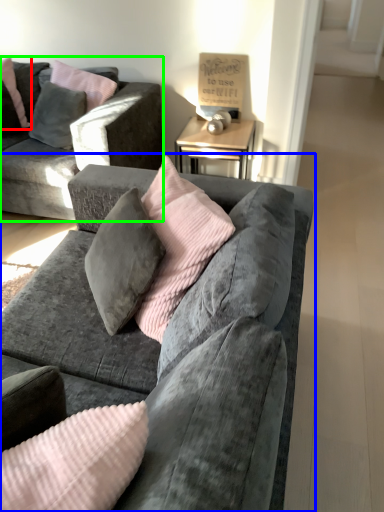
Question: Which object is the closest to the pillow (highlighted by a red box)? Choose among these: studio couch (highlighted by a blue box) or studio couch (highlighted by a green box).

Choices:
 (A) studio couch
 (B) studio couch

Answer: (B)